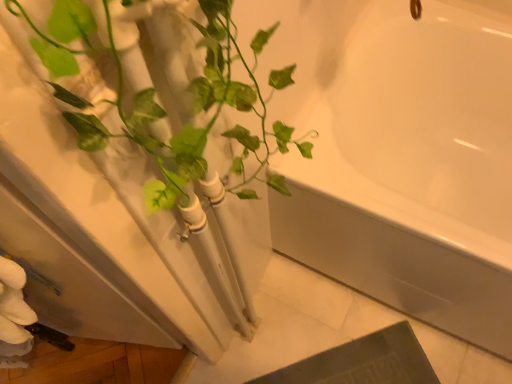
Question: Is green glossy plant at left smaller than white glossy bathtub at upper right?

Choices:
 (A) no
 (B) yes

Answer: (B)

Question: Does green glossy plant at left have a greater width compared to white glossy bathtub at upper right?

Choices:
 (A) no
 (B) yes

Answer: (A)

Question: Does green glossy plant at left turn towards white glossy bathtub at upper right?

Choices:
 (A) no
 (B) yes

Answer: (A)

Question: Is green glossy plant at left beside white glossy bathtub at upper right?

Choices:
 (A) no
 (B) yes

Answer: (A)

Question: Is green glossy plant at left located outside white glossy bathtub at upper right?

Choices:
 (A) yes
 (B) no

Answer: (A)

Question: From the image's perspective, is green glossy plant at left on white glossy bathtub at upper right?

Choices:
 (A) yes
 (B) no

Answer: (B)

Question: Can you confirm if white glossy bathtub at upper right is positioned to the right of green glossy plant at left?

Choices:
 (A) no
 (B) yes

Answer: (B)

Question: Does white glossy bathtub at upper right turn towards green glossy plant at left?

Choices:
 (A) yes
 (B) no

Answer: (B)

Question: Is white glossy bathtub at upper right not near green glossy plant at left?

Choices:
 (A) no
 (B) yes

Answer: (A)

Question: Is white glossy bathtub at upper right completely or partially outside of green glossy plant at left?

Choices:
 (A) yes
 (B) no

Answer: (A)

Question: From a real-world perspective, does white glossy bathtub at upper right sit lower than green glossy plant at left?

Choices:
 (A) no
 (B) yes

Answer: (B)

Question: Is white glossy bathtub at upper right smaller than green glossy plant at left?

Choices:
 (A) yes
 (B) no

Answer: (B)

Question: From their relative heights in the image, would you say white glossy bathtub at upper right is taller or shorter than green glossy plant at left?

Choices:
 (A) short
 (B) tall

Answer: (A)